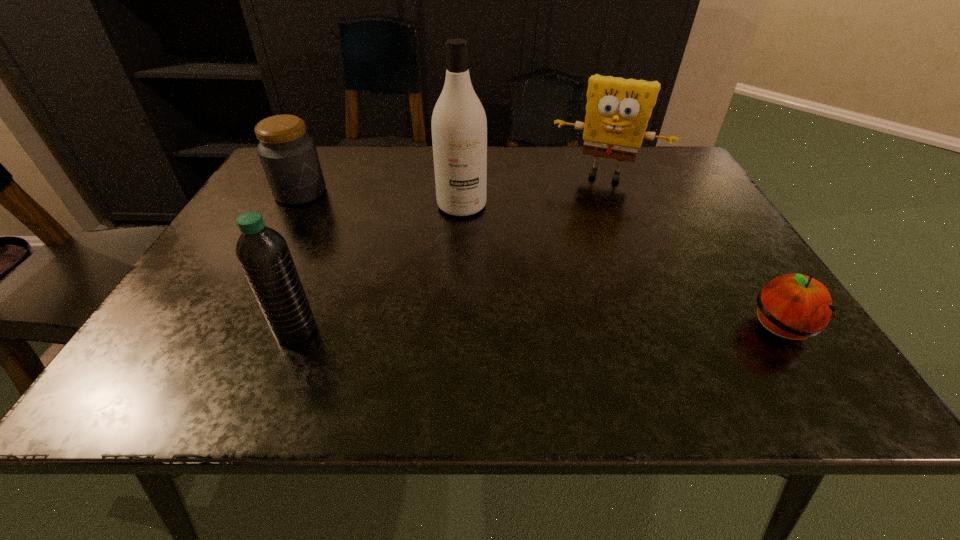
In the image, there is a desktop. Identify the location of vacant space at the left edge. (267, 190).

You are a GUI agent. You are given a task and a screenshot of the screen. Output one action in this format:
    pyautogui.click(x=<x>, y=<y>)
    Task: Click on the free location at the right edge
    
    Given the screenshot: What is the action you would take?
    pyautogui.click(x=688, y=213)

You are a GUI agent. You are given a task and a screenshot of the screen. Output one action in this format:
    pyautogui.click(x=<x>, y=<y>)
    Task: Click on the vacant region at the near left corner of the desktop
    Image resolution: width=960 pixels, height=540 pixels.
    Given the screenshot: What is the action you would take?
    pyautogui.click(x=239, y=340)

Identify the location of free region at the far right corner of the desktop. (640, 160).

You are a GUI agent. You are given a task and a screenshot of the screen. Output one action in this format:
    pyautogui.click(x=<x>, y=<y>)
    Task: Click on the blank space at the near right corner
    Image resolution: width=960 pixels, height=540 pixels.
    Given the screenshot: What is the action you would take?
    pyautogui.click(x=747, y=321)

Find the location of a particular element. The width and height of the screenshot is (960, 540). free spot between the third object from right to left and the fourth object from left to right is located at coordinates (533, 190).

At what (x,y) coordinates should I click in order to perform the action: click on empty location between the shampoo and the leftmost object. Please return your answer as a coordinate pair (x, y). This screenshot has height=540, width=960. Looking at the image, I should click on pos(381,199).

Identify the location of vacant area that lies between the apple and the jar. The width and height of the screenshot is (960, 540). (540, 261).

The width and height of the screenshot is (960, 540). In order to click on free area in between the jar and the rightmost object in this screenshot , I will do `click(540, 261)`.

I want to click on free point between the leftmost object and the fourth object from right to left, so click(x=299, y=262).